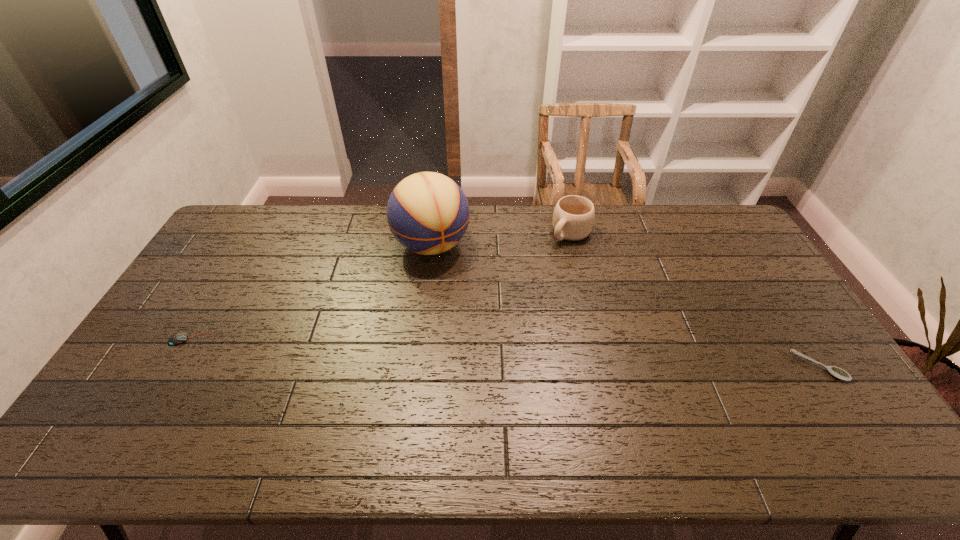
The height and width of the screenshot is (540, 960). What are the coordinates of `vacant region located 0.340m on the patterned surface of the tallest object` in the screenshot? It's located at (488, 343).

At what (x,y) coordinates should I click in order to perform the action: click on free space located 0.090m on the patterned surface of the tallest object. Please return your answer as a coordinate pair (x, y). The width and height of the screenshot is (960, 540). Looking at the image, I should click on pyautogui.click(x=456, y=287).

Locate an element on the screen. The width and height of the screenshot is (960, 540). vacant position located on the patterned surface of the tallest object is located at coordinates (463, 299).

I want to click on free spot located on the side of the second tallest object with the handle, so click(505, 295).

At what (x,y) coordinates should I click in order to perform the action: click on free space located on the side of the second tallest object with the handle. Please return your answer as a coordinate pair (x, y). This screenshot has height=540, width=960. Looking at the image, I should click on (513, 288).

This screenshot has width=960, height=540. In order to click on free location located 0.400m on the side of the second tallest object with the handle in this screenshot , I will do click(x=492, y=308).

The width and height of the screenshot is (960, 540). In order to click on basketball that is at the far edge in this screenshot , I will do `click(428, 213)`.

Identify the location of mug at the far edge. (573, 218).

The width and height of the screenshot is (960, 540). I want to click on object that is positioned at the left edge, so click(x=178, y=338).

You are a GUI agent. You are given a task and a screenshot of the screen. Output one action in this format:
    pyautogui.click(x=<x>, y=<y>)
    Task: Click on the object positioned at the right edge
    
    Given the screenshot: What is the action you would take?
    pyautogui.click(x=837, y=372)